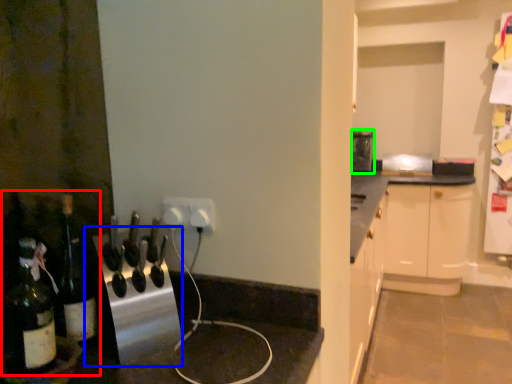
Question: Which is farther away from wine tasting (highlighted by a red box)? appliance (highlighted by a blue box) or appliance (highlighted by a green box)?

Choices:
 (A) appliance
 (B) appliance

Answer: (B)